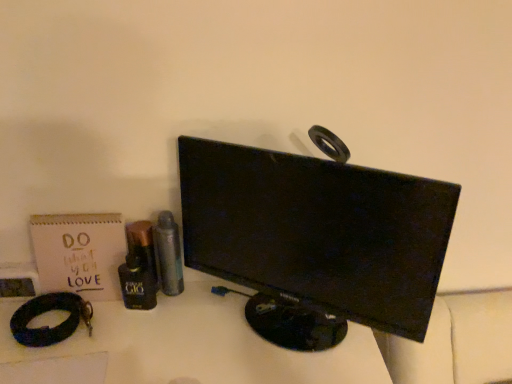
What do you see at coordinates (168, 254) in the screenshot?
I see `metallic silver spray can at center-left, marked as the 3th toiletry in a left-to-right arrangement` at bounding box center [168, 254].

What do you see at coordinates (317, 232) in the screenshot?
I see `black glossy monitor at center` at bounding box center [317, 232].

What do you see at coordinates (143, 246) in the screenshot?
I see `shiny brown bottle at center-left, the 1th toiletry positioned from the left` at bounding box center [143, 246].

In order to click on shiny black bottle at center left, the 2th toiletry when ordered from right to left in this screenshot , I will do `click(137, 283)`.

Does matte paper notebook at left have a smaller size compared to metallic silver spray can at center-left, placed as the first toiletry when sorted from right to left?

No.

Which point is more distant from viewer, (123, 248) or (174, 266)?

The point (174, 266) is behind.

Would you say matte paper notebook at left is outside metallic silver spray can at center-left, marked as the 3th toiletry in a left-to-right arrangement?

Yes, matte paper notebook at left is located beyond the bounds of metallic silver spray can at center-left, marked as the 3th toiletry in a left-to-right arrangement.

Which of these two, matte paper notebook at left or metallic silver spray can at center-left, placed as the first toiletry when sorted from right to left, is thinner?

matte paper notebook at left is thinner.

Looking at this image, from the image's perspective, is black leather bracelet at lower left under metallic silver spray can at center-left, marked as the 3th toiletry in a left-to-right arrangement?

Correct, black leather bracelet at lower left appears lower than metallic silver spray can at center-left, marked as the 3th toiletry in a left-to-right arrangement, in the image.

Is black leather bracelet at lower left positioned in front of metallic silver spray can at center-left, placed as the first toiletry when sorted from right to left?

Yes.

Is point (37, 330) closer to viewer compared to point (152, 233)?

That is True.

Considering the sizes of objects black leather bracelet at lower left and metallic silver spray can at center-left, marked as the 3th toiletry in a left-to-right arrangement, in the image provided, who is bigger, black leather bracelet at lower left or metallic silver spray can at center-left, marked as the 3th toiletry in a left-to-right arrangement,?

black leather bracelet at lower left is bigger.

Are shiny brown bottle at center-left, the 1th toiletry positioned from the left, and black glossy monitor at center beside each other?

No, shiny brown bottle at center-left, the 1th toiletry positioned from the left, is not making contact with black glossy monitor at center.

Which is more to the left, shiny brown bottle at center-left, acting as the 3th toiletry starting from the right, or black glossy monitor at center?

shiny brown bottle at center-left, acting as the 3th toiletry starting from the right.

Is shiny brown bottle at center-left, the 1th toiletry positioned from the left, spatially inside black glossy monitor at center, or outside of it?

shiny brown bottle at center-left, the 1th toiletry positioned from the left, is not enclosed by black glossy monitor at center.

At what (x,y) coordinates should I click in order to perform the action: click on computer monitor that appears above the shiny brown bottle at center-left, the 1th toiletry positioned from the left (from a real-world perspective). Please return your answer as a coordinate pair (x, y). Image resolution: width=512 pixels, height=384 pixels. Looking at the image, I should click on (x=317, y=232).

Which of these two, metallic silver spray can at center-left, marked as the 3th toiletry in a left-to-right arrangement, or black leather bracelet at lower left, is wider?

Wider between the two is black leather bracelet at lower left.

Which is less distant, (164, 287) or (72, 295)?

Point (164, 287) is positioned farther from the camera compared to point (72, 295).

Is black leather bracelet at lower left inside metallic silver spray can at center-left, marked as the 3th toiletry in a left-to-right arrangement?

No, black leather bracelet at lower left is not a part of metallic silver spray can at center-left, marked as the 3th toiletry in a left-to-right arrangement.

Considering the sizes of objects metallic silver spray can at center-left, placed as the first toiletry when sorted from right to left, and black leather bracelet at lower left in the image provided, who is bigger, metallic silver spray can at center-left, placed as the first toiletry when sorted from right to left, or black leather bracelet at lower left?

black leather bracelet at lower left.

I want to click on toiletry that is the 1st object directly below the black glossy monitor at center (from a real-world perspective), so [x=168, y=254].

Is metallic silver spray can at center-left, placed as the first toiletry when sorted from right to left, in front of black glossy monitor at center?

No, it is not.

Are metallic silver spray can at center-left, placed as the first toiletry when sorted from right to left, and black glossy monitor at center located far from each other?

metallic silver spray can at center-left, placed as the first toiletry when sorted from right to left, is near black glossy monitor at center, not far away.

How many degrees apart are the facing directions of metallic silver spray can at center-left, placed as the first toiletry when sorted from right to left, and black glossy monitor at center?

The angular difference between metallic silver spray can at center-left, placed as the first toiletry when sorted from right to left, and black glossy monitor at center is 29.9 degrees.

In terms of size, does metallic silver spray can at center-left, placed as the first toiletry when sorted from right to left, appear bigger or smaller than shiny black bottle at center left, the 2th toiletry when ordered from right to left?

In the image, metallic silver spray can at center-left, placed as the first toiletry when sorted from right to left, appears to be smaller than shiny black bottle at center left, the 2th toiletry when ordered from right to left.

Can you confirm if metallic silver spray can at center-left, placed as the first toiletry when sorted from right to left, is positioned to the right of shiny black bottle at center left, the second toiletry when ordered from left to right?

Yes, metallic silver spray can at center-left, placed as the first toiletry when sorted from right to left, is to the right of shiny black bottle at center left, the second toiletry when ordered from left to right.

Looking at their sizes, would you say metallic silver spray can at center-left, placed as the first toiletry when sorted from right to left, is wider or thinner than shiny black bottle at center left, the second toiletry when ordered from left to right?

In the image, metallic silver spray can at center-left, placed as the first toiletry when sorted from right to left, appears to be wider than shiny black bottle at center left, the second toiletry when ordered from left to right.

Is metallic silver spray can at center-left, placed as the first toiletry when sorted from right to left, not within shiny black bottle at center left, the second toiletry when ordered from left to right?

That's correct, metallic silver spray can at center-left, placed as the first toiletry when sorted from right to left, is outside of shiny black bottle at center left, the second toiletry when ordered from left to right.

Who is bigger, shiny brown bottle at center-left, the 1th toiletry positioned from the left, or metallic silver spray can at center-left, placed as the first toiletry when sorted from right to left?

With larger size is metallic silver spray can at center-left, placed as the first toiletry when sorted from right to left.

From a real-world perspective, between shiny brown bottle at center-left, acting as the 3th toiletry starting from the right, and metallic silver spray can at center-left, marked as the 3th toiletry in a left-to-right arrangement, who is vertically higher?

metallic silver spray can at center-left, marked as the 3th toiletry in a left-to-right arrangement, is physically above.

From the image's perspective, is shiny brown bottle at center-left, acting as the 3th toiletry starting from the right, located above or below metallic silver spray can at center-left, marked as the 3th toiletry in a left-to-right arrangement?

shiny brown bottle at center-left, acting as the 3th toiletry starting from the right, is situated lower than metallic silver spray can at center-left, marked as the 3th toiletry in a left-to-right arrangement, in the image.

Is shiny brown bottle at center-left, the 1th toiletry positioned from the left, looking in the opposite direction of metallic silver spray can at center-left, placed as the first toiletry when sorted from right to left?

shiny brown bottle at center-left, the 1th toiletry positioned from the left, is not turned away from metallic silver spray can at center-left, placed as the first toiletry when sorted from right to left.

Identify the location of paperback book directly beneath the metallic silver spray can at center-left, marked as the 3th toiletry in a left-to-right arrangement (from a real-world perspective). The image size is (512, 384). (79, 253).

The height and width of the screenshot is (384, 512). Find the location of `the 3rd toiletry to the right when counting from the black leather bracelet at lower left`. the 3rd toiletry to the right when counting from the black leather bracelet at lower left is located at coordinates (168, 254).

From the image, which object appears to be nearer to shiny black bottle at center left, the second toiletry when ordered from left to right, matte paper notebook at left or shiny brown bottle at center-left, acting as the 3th toiletry starting from the right?

Based on the image, shiny brown bottle at center-left, acting as the 3th toiletry starting from the right, appears to be nearer to shiny black bottle at center left, the second toiletry when ordered from left to right.

Looking at the image, which one is located further to matte paper notebook at left, black leather bracelet at lower left or black glossy monitor at center?

black glossy monitor at center is positioned further to the anchor matte paper notebook at left.

Which object lies further to the anchor point metallic silver spray can at center-left, placed as the first toiletry when sorted from right to left, shiny brown bottle at center-left, acting as the 3th toiletry starting from the right, or matte paper notebook at left?

matte paper notebook at left is positioned further to the anchor metallic silver spray can at center-left, placed as the first toiletry when sorted from right to left.

Consider the image. Which object lies nearer to the anchor point matte paper notebook at left, black glossy monitor at center or shiny brown bottle at center-left, acting as the 3th toiletry starting from the right?

shiny brown bottle at center-left, acting as the 3th toiletry starting from the right.

When comparing their distances from matte paper notebook at left, does metallic silver spray can at center-left, marked as the 3th toiletry in a left-to-right arrangement, or black glossy monitor at center seem further?

black glossy monitor at center is further to matte paper notebook at left.

Considering their positions, is black leather bracelet at lower left positioned further to shiny black bottle at center left, the second toiletry when ordered from left to right, than shiny brown bottle at center-left, acting as the 3th toiletry starting from the right?

black leather bracelet at lower left lies further to shiny black bottle at center left, the second toiletry when ordered from left to right, than the other object.

When comparing their distances from metallic silver spray can at center-left, marked as the 3th toiletry in a left-to-right arrangement, does black glossy monitor at center or black leather bracelet at lower left seem closer?

Based on the image, black leather bracelet at lower left appears to be nearer to metallic silver spray can at center-left, marked as the 3th toiletry in a left-to-right arrangement.

Considering their positions, is black leather bracelet at lower left positioned closer to metallic silver spray can at center-left, marked as the 3th toiletry in a left-to-right arrangement, than matte paper notebook at left?

matte paper notebook at left is closer to metallic silver spray can at center-left, marked as the 3th toiletry in a left-to-right arrangement.

Image resolution: width=512 pixels, height=384 pixels. Identify the location of toiletry located between shiny brown bottle at center-left, the 1th toiletry positioned from the left, and metallic silver spray can at center-left, marked as the 3th toiletry in a left-to-right arrangement, in the left-right direction. (137, 283).

Locate an element on the screen. This screenshot has width=512, height=384. toiletry between black leather bracelet at lower left and shiny black bottle at center left, the second toiletry when ordered from left to right, from left to right is located at coordinates (143, 246).

You are a GUI agent. You are given a task and a screenshot of the screen. Output one action in this format:
    pyautogui.click(x=<x>, y=<y>)
    Task: Click on the paperback book between black leather bracelet at lower left and metallic silver spray can at center-left, marked as the 3th toiletry in a left-to-right arrangement, in the horizontal direction
    The image size is (512, 384).
    Given the screenshot: What is the action you would take?
    pyautogui.click(x=79, y=253)

At what (x,y) coordinates should I click in order to perform the action: click on toiletry between matte paper notebook at left and shiny black bottle at center left, the second toiletry when ordered from left to right, in the horizontal direction. Please return your answer as a coordinate pair (x, y). This screenshot has width=512, height=384. Looking at the image, I should click on (143, 246).